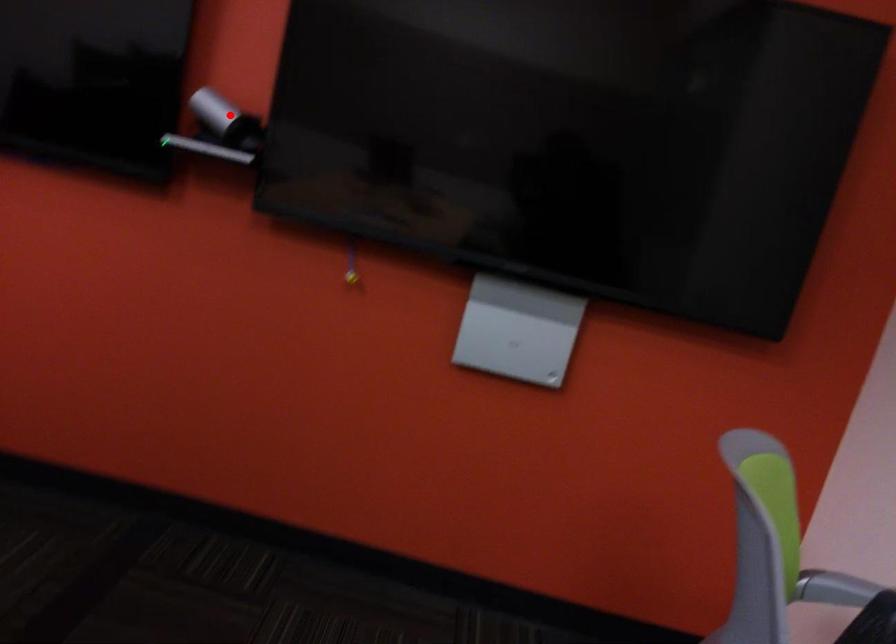
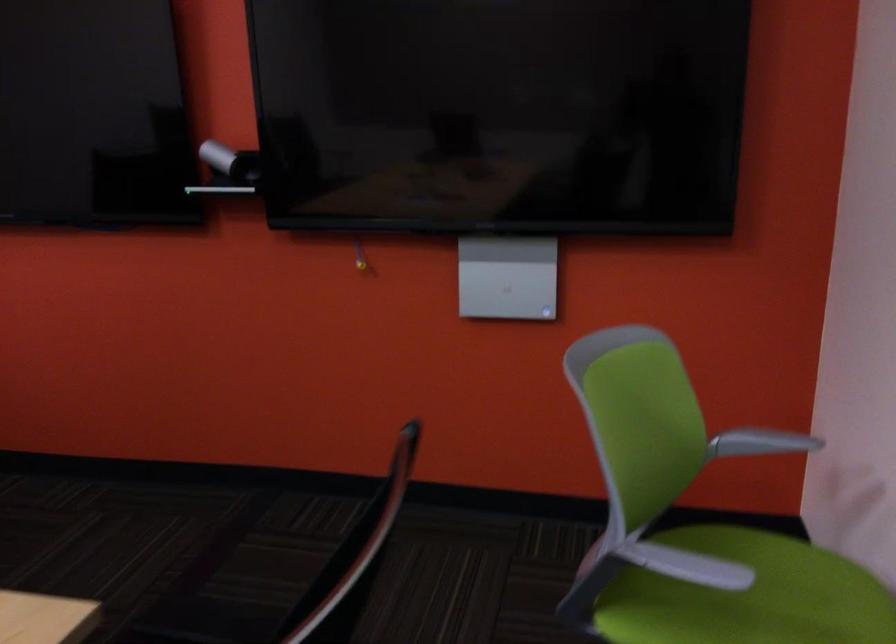
Question: A red point is marked in image1. In image2, is the corresponding 3D point closer to the camera or farther? Reply with the corresponding letter.

Choices:
 (A) The corresponding 3D point is closer.
 (B) The corresponding 3D point is farther.

Answer: (B)